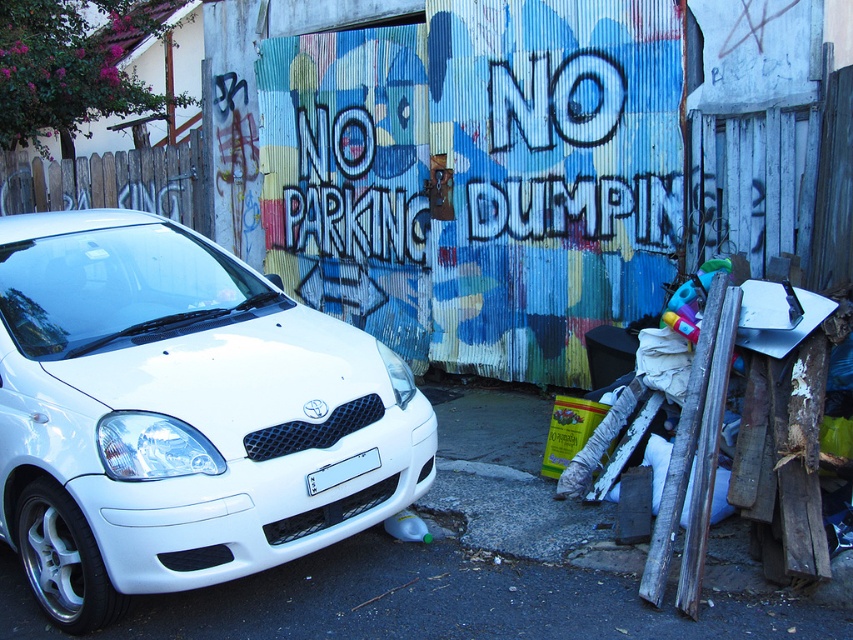
Based on the photo, does white glossy car at left have a larger size compared to white plastic license plate at center?

Yes.

You are a GUI agent. You are given a task and a screenshot of the screen. Output one action in this format:
    pyautogui.click(x=<x>, y=<y>)
    Task: Click on the white glossy car at left
    
    Given the screenshot: What is the action you would take?
    pyautogui.click(x=178, y=413)